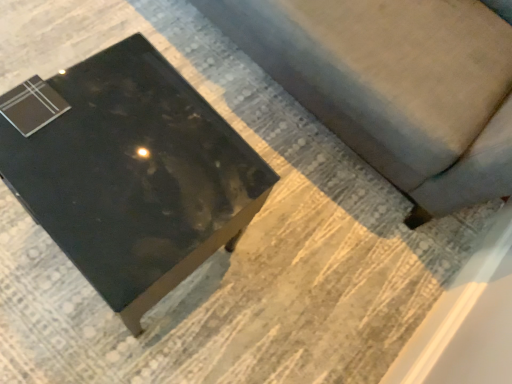
The height and width of the screenshot is (384, 512). Identify the location of glossy black table at lower left. (134, 176).

Describe the element at coordinates (134, 176) in the screenshot. I see `glossy black table at lower left` at that location.

Locate an element on the screen. suede-like gray couch at lower right is located at coordinates (394, 85).

This screenshot has height=384, width=512. What do you see at coordinates (394, 85) in the screenshot?
I see `suede-like gray couch at lower right` at bounding box center [394, 85].

I want to click on glossy black table at lower left, so click(134, 176).

Considering the relative positions of glossy black table at lower left and suede-like gray couch at lower right in the image provided, is glossy black table at lower left to the left or to the right of suede-like gray couch at lower right?

From the image, it's evident that glossy black table at lower left is to the left of suede-like gray couch at lower right.

Who is more distant, glossy black table at lower left or suede-like gray couch at lower right?

glossy black table at lower left is further from the camera.

Does point (158, 278) come farther from viewer compared to point (392, 87)?

No, it is not.

From the image's perspective, is glossy black table at lower left on top of suede-like gray couch at lower right?

No, from the image's perspective, glossy black table at lower left is not above suede-like gray couch at lower right.

From a real-world perspective, which object rests below the other?

glossy black table at lower left is physically lower.

Considering the relative sizes of glossy black table at lower left and suede-like gray couch at lower right in the image provided, is glossy black table at lower left thinner than suede-like gray couch at lower right?

Yes.

Can you confirm if glossy black table at lower left is taller than suede-like gray couch at lower right?

In fact, glossy black table at lower left may be shorter than suede-like gray couch at lower right.

Considering the sizes of glossy black table at lower left and suede-like gray couch at lower right in the image, is glossy black table at lower left bigger or smaller than suede-like gray couch at lower right?

Clearly, glossy black table at lower left is smaller in size than suede-like gray couch at lower right.

Does glossy black table at lower left contain suede-like gray couch at lower right?

Actually, suede-like gray couch at lower right is outside glossy black table at lower left.

Is glossy black table at lower left with suede-like gray couch at lower right?

No, glossy black table at lower left is not next to suede-like gray couch at lower right.

Is glossy black table at lower left positioned with its back to suede-like gray couch at lower right?

No, glossy black table at lower left's orientation is not away from suede-like gray couch at lower right.

What's the angular difference between glossy black table at lower left and suede-like gray couch at lower right's facing directions?

90.3 degrees.

This screenshot has height=384, width=512. In the image, there is a glossy black table at lower left. What are the coordinates of `couch above it (from the image's perspective)` in the screenshot? It's located at (394, 85).

Which is more to the right, suede-like gray couch at lower right or glossy black table at lower left?

suede-like gray couch at lower right is more to the right.

Which is in front, suede-like gray couch at lower right or glossy black table at lower left?

suede-like gray couch at lower right is in front.

Which is farther, (331, 7) or (157, 151)?

The point (331, 7) is farther from the camera.

From the image's perspective, is suede-like gray couch at lower right beneath glossy black table at lower left?

No.

From a real-world perspective, is suede-like gray couch at lower right on glossy black table at lower left?

Yes, from a real-world perspective, suede-like gray couch at lower right is above glossy black table at lower left.

Is suede-like gray couch at lower right wider than glossy black table at lower left?

Correct, the width of suede-like gray couch at lower right exceeds that of glossy black table at lower left.

Who is taller, suede-like gray couch at lower right or glossy black table at lower left?

suede-like gray couch at lower right is taller.

Which of these two, suede-like gray couch at lower right or glossy black table at lower left, is smaller?

With smaller size is glossy black table at lower left.

Is suede-like gray couch at lower right not inside glossy black table at lower left?

suede-like gray couch at lower right lies outside glossy black table at lower left's area.

Is the surface of suede-like gray couch at lower right in direct contact with glossy black table at lower left?

No.

Is suede-like gray couch at lower right oriented away from glossy black table at lower left?

No, glossy black table at lower left is not at the back of suede-like gray couch at lower right.

How many degrees apart are the facing directions of suede-like gray couch at lower right and glossy black table at lower left?

The facing directions of suede-like gray couch at lower right and glossy black table at lower left are 90.3 degrees apart.

Where is `couch in front of the glossy black table at lower left`? couch in front of the glossy black table at lower left is located at coordinates (394, 85).

Find the location of a particular element. couch above the glossy black table at lower left (from the image's perspective) is located at coordinates (394, 85).

Locate an element on the screen. This screenshot has width=512, height=384. table that is on the left side of suede-like gray couch at lower right is located at coordinates (134, 176).